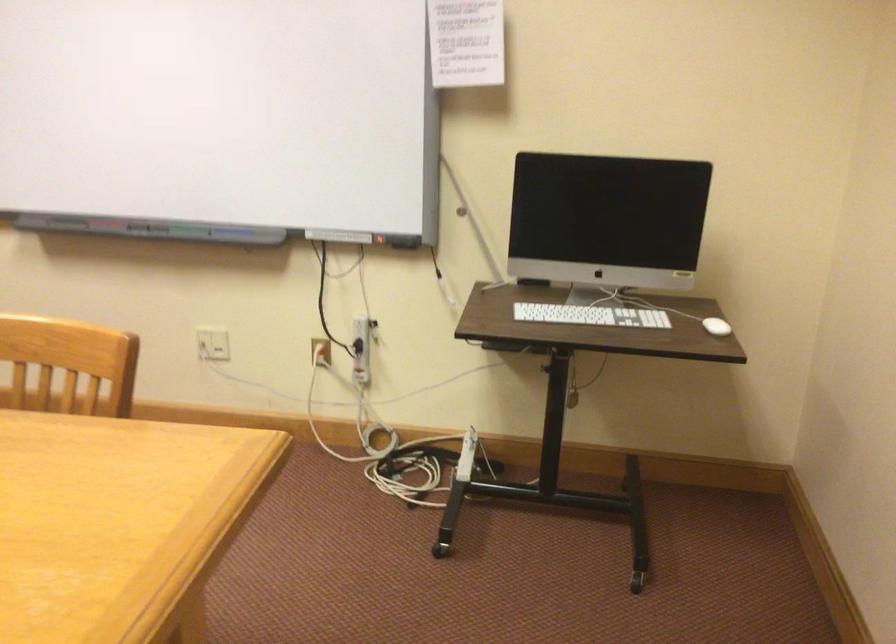
Where would you press the red power strip switch? Please return your answer as a coordinate pair (x, y).

(321, 351)